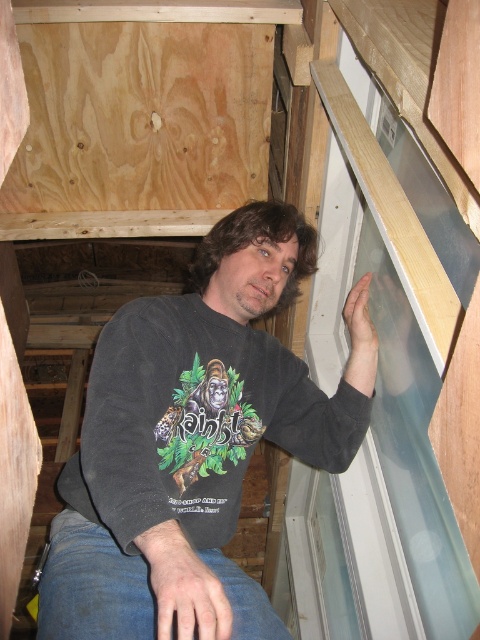
You are standing in the unfinished wooden structure and want to check the weather outside through the transparent glass window at upper center. However, you notice the dark gray sweatshirt at center is blocking your view. Can you estimate if the window is wider than the sweatshirt to see around it?

The transparent glass window at upper center has a lesser width compared to dark gray sweatshirt at center, so the window is narrower than the sweatshirt. Therefore, the dark gray sweatshirt at center is wider, blocking the view completely. You cannot see around it.